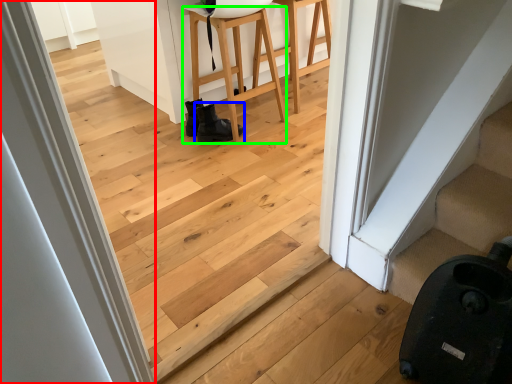
Question: Which object is the closest to the door (highlighted by a red box)? Choose among these: footwear (highlighted by a blue box) or furniture (highlighted by a green box).

Choices:
 (A) footwear
 (B) furniture

Answer: (A)